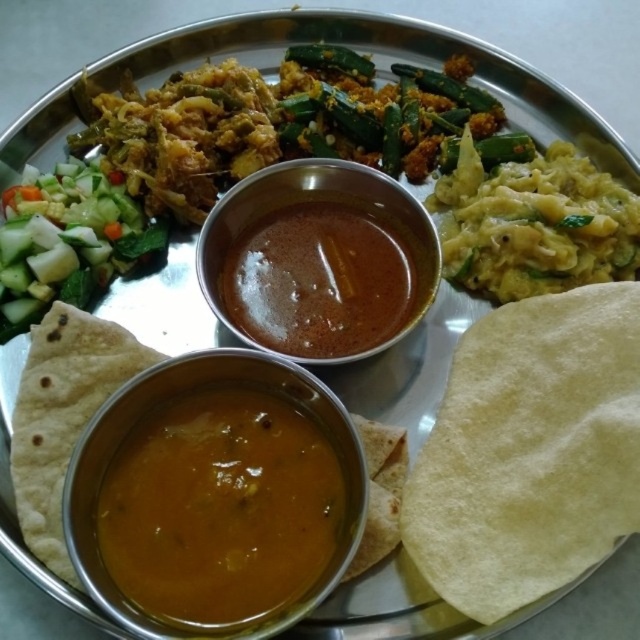
Where is the brown thick sauce at center located in the image?

The brown thick sauce at center is located at point 0.441 on the x axis and 0.500 on the y axis.

You are a food critic evaluating the presentation of this Indian meal. The metallic plate has a brown thick sauce at center and a green crisp cucumber at left. Based on their sizes, which item takes up more space horizontally on the plate?

The brown thick sauce at center takes up more space horizontally on the plate because its width surpasses that of the green crisp cucumber at left.